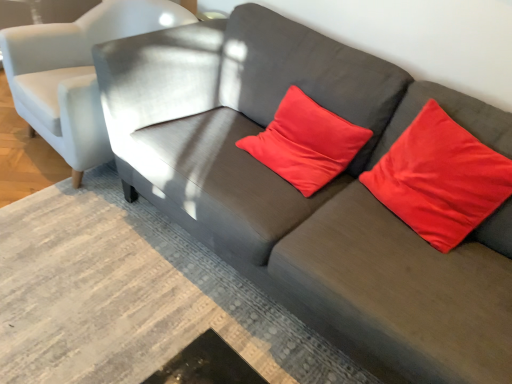
This screenshot has height=384, width=512. What do you see at coordinates (306, 143) in the screenshot?
I see `satin red pillow at center, which is the first pillow from left to right` at bounding box center [306, 143].

This screenshot has width=512, height=384. What do you see at coordinates (75, 74) in the screenshot? I see `light gray fabric chair at upper left` at bounding box center [75, 74].

Consider the image. Measure the distance between point (66, 112) and camera.

Point (66, 112) and camera are 1.78 meters apart.

Where is `satin red pillow at center, which is the first pillow from left to right`? Image resolution: width=512 pixels, height=384 pixels. satin red pillow at center, which is the first pillow from left to right is located at coordinates (306, 143).

From a real-world perspective, is light gray fabric chair at upper left physically below satin red pillow at center, which is the first pillow from left to right?

Indeed, from a real-world perspective, light gray fabric chair at upper left is positioned beneath satin red pillow at center, which is the first pillow from left to right.

Is light gray fabric chair at upper left taller or shorter than satin red pillow at center, placed as the 2th pillow when sorted from right to left?

Considering their sizes, light gray fabric chair at upper left has more height than satin red pillow at center, placed as the 2th pillow when sorted from right to left.

How different are the orientations of light gray fabric chair at upper left and satin red pillow at center, which is the first pillow from left to right, in degrees?

The angular difference between light gray fabric chair at upper left and satin red pillow at center, which is the first pillow from left to right, is 0.862 degrees.

Is light gray fabric chair at upper left directly adjacent to satin red pillow at center, placed as the 2th pillow when sorted from right to left?

There is a gap between light gray fabric chair at upper left and satin red pillow at center, placed as the 2th pillow when sorted from right to left.

Considering the sizes of objects satin red pillow at center, placed as the 2th pillow when sorted from right to left, and satin red pillow at upper right, acting as the first pillow starting from the right, in the image provided, who is wider, satin red pillow at center, placed as the 2th pillow when sorted from right to left, or satin red pillow at upper right, acting as the first pillow starting from the right,?

With larger width is satin red pillow at center, placed as the 2th pillow when sorted from right to left.

Is satin red pillow at center, placed as the 2th pillow when sorted from right to left, facing towards satin red pillow at upper right, acting as the first pillow starting from the right?

No, satin red pillow at center, placed as the 2th pillow when sorted from right to left, is not facing towards satin red pillow at upper right, acting as the first pillow starting from the right.

Considering the relative positions of satin red pillow at center, which is the first pillow from left to right, and satin red pillow at upper right, acting as the first pillow starting from the right, in the image provided, is satin red pillow at center, which is the first pillow from left to right, to the right of satin red pillow at upper right, acting as the first pillow starting from the right, from the viewer's perspective?

In fact, satin red pillow at center, which is the first pillow from left to right, is to the left of satin red pillow at upper right, acting as the first pillow starting from the right.

Between satin red pillow at center, placed as the 2th pillow when sorted from right to left, and satin red pillow at upper right, acting as the first pillow starting from the right, which one is positioned in front?

satin red pillow at upper right, acting as the first pillow starting from the right, is in front.

Do you think satin red pillow at upper right, acting as the first pillow starting from the right, is within satin red pillow at center, which is the first pillow from left to right, or outside of it?

satin red pillow at upper right, acting as the first pillow starting from the right, is spatially situated outside satin red pillow at center, which is the first pillow from left to right.

Is satin red pillow at upper right, placed as the second pillow when sorted from left to right, aimed at satin red pillow at center, placed as the 2th pillow when sorted from right to left?

No, satin red pillow at upper right, placed as the second pillow when sorted from left to right, is not facing towards satin red pillow at center, placed as the 2th pillow when sorted from right to left.

Based on their sizes in the image, would you say satin red pillow at upper right, acting as the first pillow starting from the right, is bigger or smaller than satin red pillow at center, placed as the 2th pillow when sorted from right to left?

Clearly, satin red pillow at upper right, acting as the first pillow starting from the right, is smaller in size than satin red pillow at center, placed as the 2th pillow when sorted from right to left.

Image resolution: width=512 pixels, height=384 pixels. I want to click on pillow below the satin red pillow at center, placed as the 2th pillow when sorted from right to left (from the image's perspective), so (x=440, y=179).

From a real-world perspective, is satin red pillow at center, placed as the 2th pillow when sorted from right to left, over light gray fabric chair at upper left?

Yes, from a real-world perspective, satin red pillow at center, placed as the 2th pillow when sorted from right to left, is above light gray fabric chair at upper left.

Can you tell me how much satin red pillow at center, placed as the 2th pillow when sorted from right to left, and light gray fabric chair at upper left differ in facing direction?

The facing directions of satin red pillow at center, placed as the 2th pillow when sorted from right to left, and light gray fabric chair at upper left are 0.862 degrees apart.

Which is in front, satin red pillow at center, placed as the 2th pillow when sorted from right to left, or light gray fabric chair at upper left?

Positioned in front is satin red pillow at center, placed as the 2th pillow when sorted from right to left.

From the image's perspective, is satin red pillow at center, which is the first pillow from left to right, on light gray fabric chair at upper left?

Incorrect, from the image's perspective, satin red pillow at center, which is the first pillow from left to right, is lower than light gray fabric chair at upper left.

Is light gray fabric chair at upper left in front of or behind satin red pillow at upper right, placed as the second pillow when sorted from left to right, in the image?

light gray fabric chair at upper left is positioned farther from the viewer than satin red pillow at upper right, placed as the second pillow when sorted from left to right.

Considering the relative sizes of light gray fabric chair at upper left and satin red pillow at upper right, acting as the first pillow starting from the right, in the image provided, is light gray fabric chair at upper left thinner than satin red pillow at upper right, acting as the first pillow starting from the right,?

In fact, light gray fabric chair at upper left might be wider than satin red pillow at upper right, acting as the first pillow starting from the right.

Based on the photo, from the image's perspective, is light gray fabric chair at upper left over satin red pillow at upper right, placed as the second pillow when sorted from left to right?

Correct, light gray fabric chair at upper left appears higher than satin red pillow at upper right, placed as the second pillow when sorted from left to right, in the image.

Looking at the image, does light gray fabric chair at upper left seem bigger or smaller compared to satin red pillow at upper right, placed as the second pillow when sorted from left to right?

In the image, light gray fabric chair at upper left appears to be larger than satin red pillow at upper right, placed as the second pillow when sorted from left to right.

Could you measure the distance between satin red pillow at upper right, acting as the first pillow starting from the right, and light gray fabric chair at upper left?

satin red pillow at upper right, acting as the first pillow starting from the right, is 1.45 meters from light gray fabric chair at upper left.

From the image's perspective, is satin red pillow at upper right, placed as the second pillow when sorted from left to right, beneath light gray fabric chair at upper left?

Indeed, from the image's perspective, satin red pillow at upper right, placed as the second pillow when sorted from left to right, is shown beneath light gray fabric chair at upper left.

Can we say satin red pillow at upper right, placed as the second pillow when sorted from left to right, lies outside light gray fabric chair at upper left?

Yes, satin red pillow at upper right, placed as the second pillow when sorted from left to right, is outside of light gray fabric chair at upper left.

Is satin red pillow at upper right, acting as the first pillow starting from the right, aimed at light gray fabric chair at upper left?

No, satin red pillow at upper right, acting as the first pillow starting from the right, does not turn towards light gray fabric chair at upper left.

Locate an element on the screen. Image resolution: width=512 pixels, height=384 pixels. chair that is above the satin red pillow at center, placed as the 2th pillow when sorted from right to left (from the image's perspective) is located at coordinates (75, 74).

Where is `pillow located below the satin red pillow at center, which is the first pillow from left to right (from the image's perspective)`? The width and height of the screenshot is (512, 384). pillow located below the satin red pillow at center, which is the first pillow from left to right (from the image's perspective) is located at coordinates (440, 179).

Which object lies further to the anchor point satin red pillow at center, placed as the 2th pillow when sorted from right to left, light gray fabric chair at upper left or satin red pillow at upper right, acting as the first pillow starting from the right?

light gray fabric chair at upper left is further to satin red pillow at center, placed as the 2th pillow when sorted from right to left.

In the scene shown: Which object lies nearer to the anchor point satin red pillow at center, placed as the 2th pillow when sorted from right to left, satin red pillow at upper right, acting as the first pillow starting from the right, or light gray fabric chair at upper left?

The object closer to satin red pillow at center, placed as the 2th pillow when sorted from right to left, is satin red pillow at upper right, acting as the first pillow starting from the right.

Considering their positions, is light gray fabric chair at upper left positioned further to satin red pillow at upper right, placed as the second pillow when sorted from left to right, than satin red pillow at center, placed as the 2th pillow when sorted from right to left?

Among the two, light gray fabric chair at upper left is located further to satin red pillow at upper right, placed as the second pillow when sorted from left to right.

Which object lies nearer to the anchor point satin red pillow at upper right, placed as the second pillow when sorted from left to right, satin red pillow at center, placed as the 2th pillow when sorted from right to left, or light gray fabric chair at upper left?

satin red pillow at center, placed as the 2th pillow when sorted from right to left.

From the image, which object appears to be nearer to light gray fabric chair at upper left, satin red pillow at upper right, placed as the second pillow when sorted from left to right, or satin red pillow at center, placed as the 2th pillow when sorted from right to left?

Among the two, satin red pillow at center, placed as the 2th pillow when sorted from right to left, is located nearer to light gray fabric chair at upper left.

Considering their positions, is satin red pillow at center, placed as the 2th pillow when sorted from right to left, positioned further to light gray fabric chair at upper left than satin red pillow at upper right, acting as the first pillow starting from the right?

satin red pillow at upper right, acting as the first pillow starting from the right, is positioned further to the anchor light gray fabric chair at upper left.

Identify the location of pillow located between light gray fabric chair at upper left and satin red pillow at upper right, acting as the first pillow starting from the right, in the left-right direction. The image size is (512, 384). (306, 143).